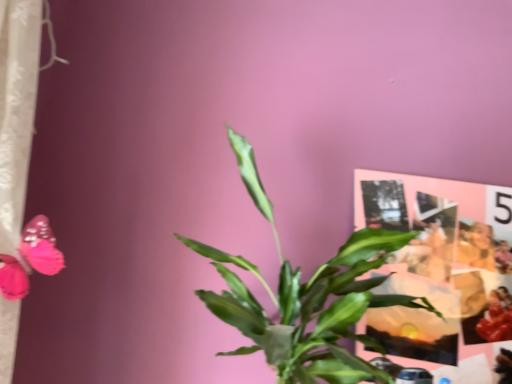
Question: Is smooth beige jacket at upper right positioned in front of matte paper collage at upper right?

Choices:
 (A) yes
 (B) no

Answer: (B)

Question: From a real-world perspective, is smooth beige jacket at upper right located beneath matte paper collage at upper right?

Choices:
 (A) no
 (B) yes

Answer: (A)

Question: Is smooth beige jacket at upper right oriented away from matte paper collage at upper right?

Choices:
 (A) no
 (B) yes

Answer: (A)

Question: Does smooth beige jacket at upper right have a lesser height compared to matte paper collage at upper right?

Choices:
 (A) no
 (B) yes

Answer: (B)

Question: Can we say smooth beige jacket at upper right lies outside matte paper collage at upper right?

Choices:
 (A) yes
 (B) no

Answer: (B)

Question: Visually, is smooth beige jacket at upper right positioned to the left or to the right of matte paper collage at upper right?

Choices:
 (A) right
 (B) left

Answer: (A)

Question: Is smooth beige jacket at upper right inside the boundaries of matte paper collage at upper right, or outside?

Choices:
 (A) inside
 (B) outside

Answer: (A)

Question: Does point (481, 253) appear closer or farther from the camera than point (357, 177)?

Choices:
 (A) farther
 (B) closer

Answer: (A)

Question: In terms of width, does smooth beige jacket at upper right look wider or thinner when compared to matte paper collage at upper right?

Choices:
 (A) thin
 (B) wide

Answer: (B)

Question: From the image's perspective, is smooth beige jacket at upper right above or below green leafy plant at center?

Choices:
 (A) below
 (B) above

Answer: (A)

Question: In terms of width, does smooth beige jacket at upper right look wider or thinner when compared to green leafy plant at center?

Choices:
 (A) thin
 (B) wide

Answer: (A)

Question: Would you say smooth beige jacket at upper right is inside or outside green leafy plant at center?

Choices:
 (A) inside
 (B) outside

Answer: (B)

Question: From a real-world perspective, is smooth beige jacket at upper right physically located above or below green leafy plant at center?

Choices:
 (A) below
 (B) above

Answer: (B)

Question: Is point [422, 253] closer or farther from the camera than point [351, 317]?

Choices:
 (A) farther
 (B) closer

Answer: (A)

Question: From the image's perspective, is matte paper collage at upper right positioned above or below green leafy plant at center?

Choices:
 (A) above
 (B) below

Answer: (B)